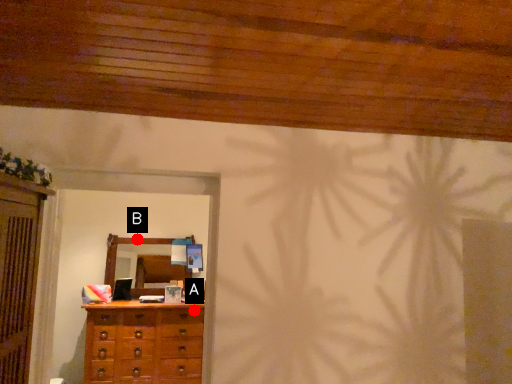
Question: Two points are circled on the image, labeled by A and B beside each circle. Which point is farther from the camera taking this photo?

Choices:
 (A) A is further
 (B) B is further

Answer: (B)